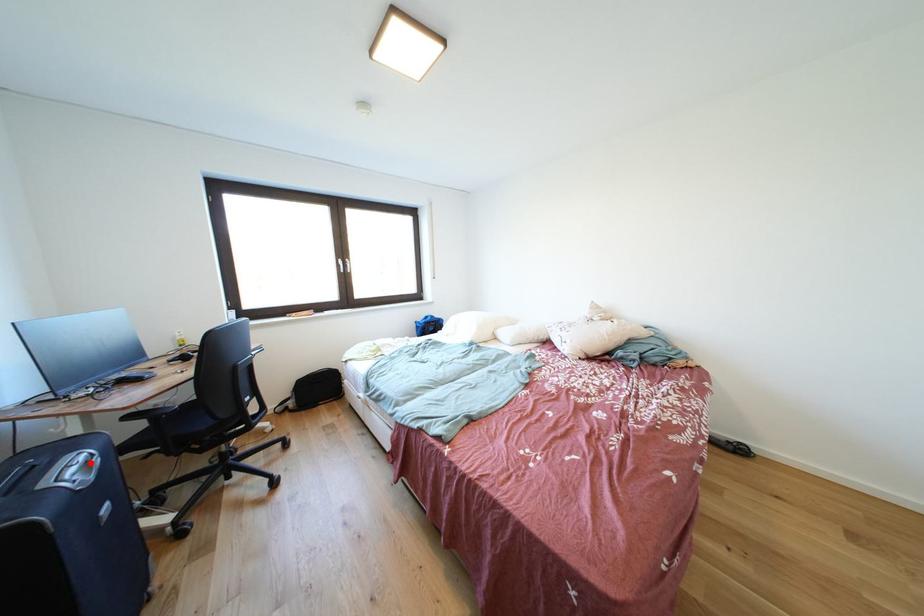
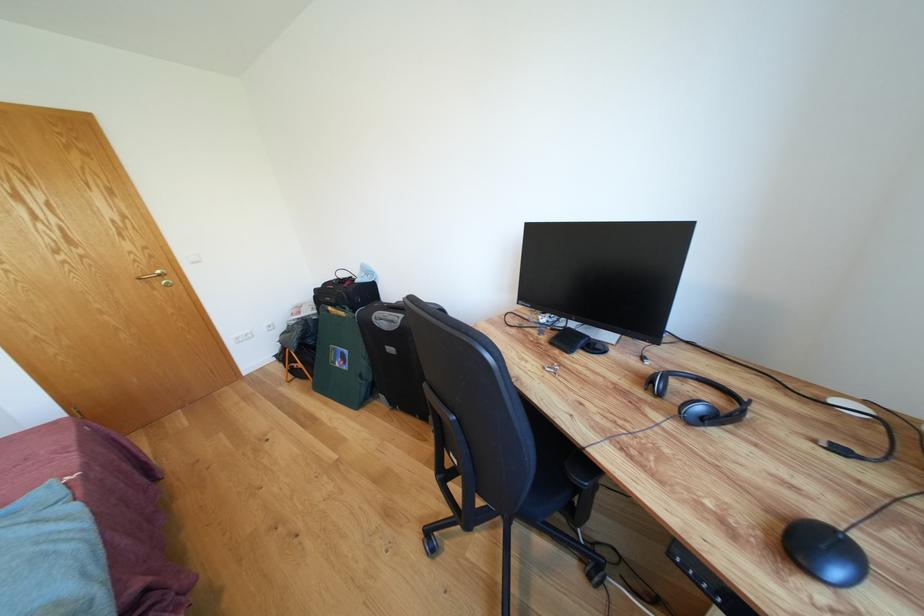
Where in the second image is the point corresponding to the highlighted location from the first image?

(398, 322)